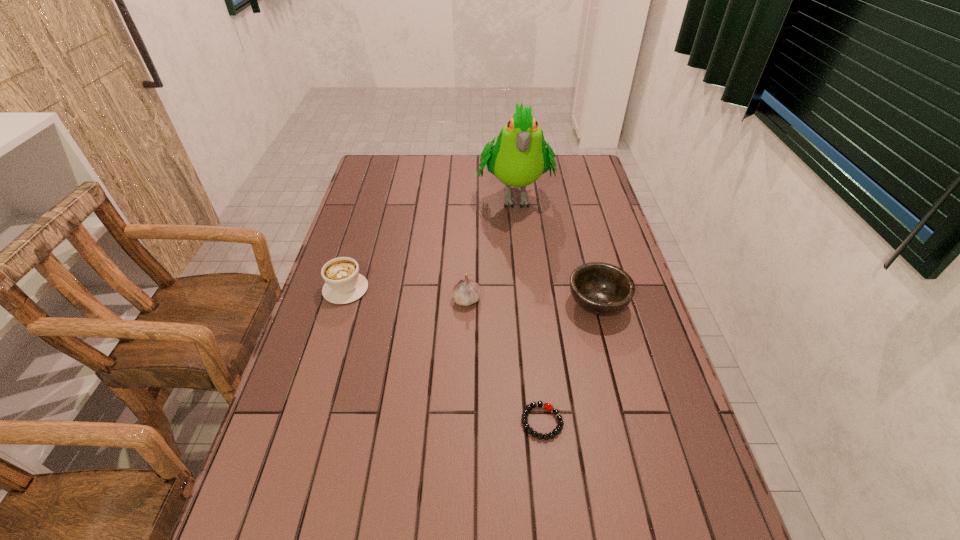
Where is `object identified as the closest to the cappuccino`? The image size is (960, 540). object identified as the closest to the cappuccino is located at coordinates (466, 292).

Locate an element on the screen. This screenshot has width=960, height=540. free space that satisfies the following two spatial constraints: 1. on the front side of the bowl; 2. on the right side of the fourth shortest object is located at coordinates (467, 303).

Locate an element on the screen. vacant space that satisfies the following two spatial constraints: 1. on the beak of the nearest object; 2. on the left side of the farthest object is located at coordinates (538, 422).

Image resolution: width=960 pixels, height=540 pixels. Identify the location of vacant region that satisfies the following two spatial constraints: 1. on the beak of the farthest object; 2. on the left side of the bracelet. (538, 422).

Identify the location of vacant space that satisfies the following two spatial constraints: 1. on the beak of the farthest object; 2. on the right side of the bowl. This screenshot has height=540, width=960. (525, 303).